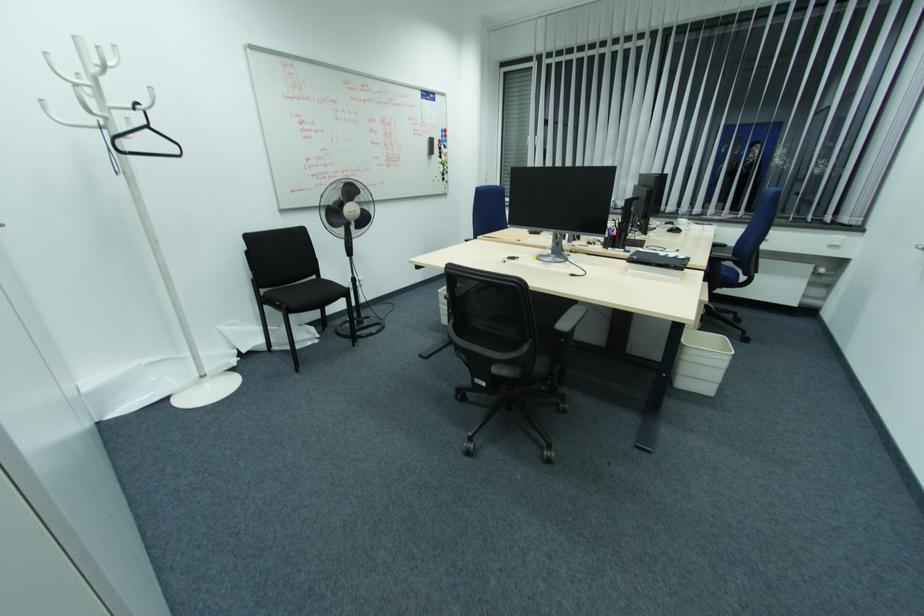
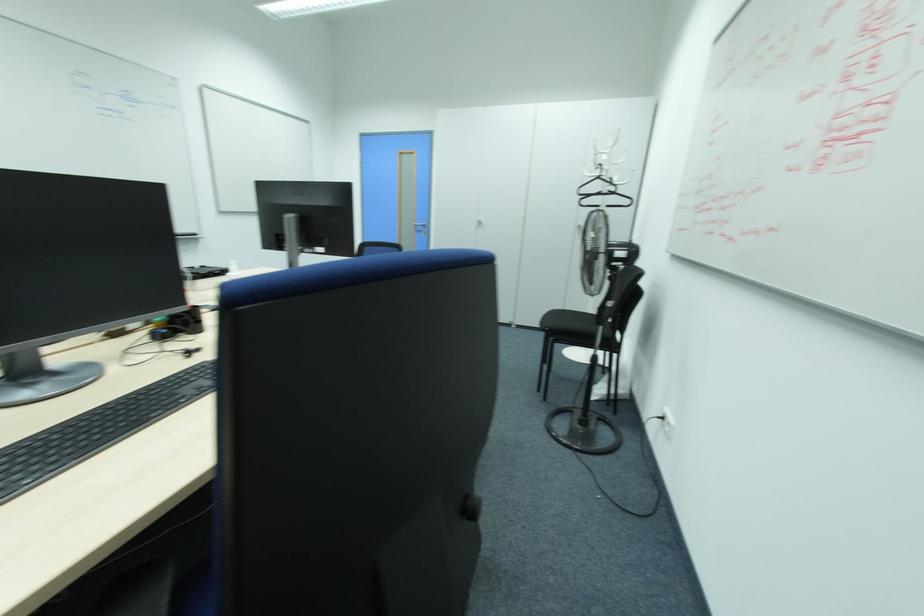
The point at (x=149, y=128) is marked in the first image. Where is the corresponding point in the second image?

(599, 177)